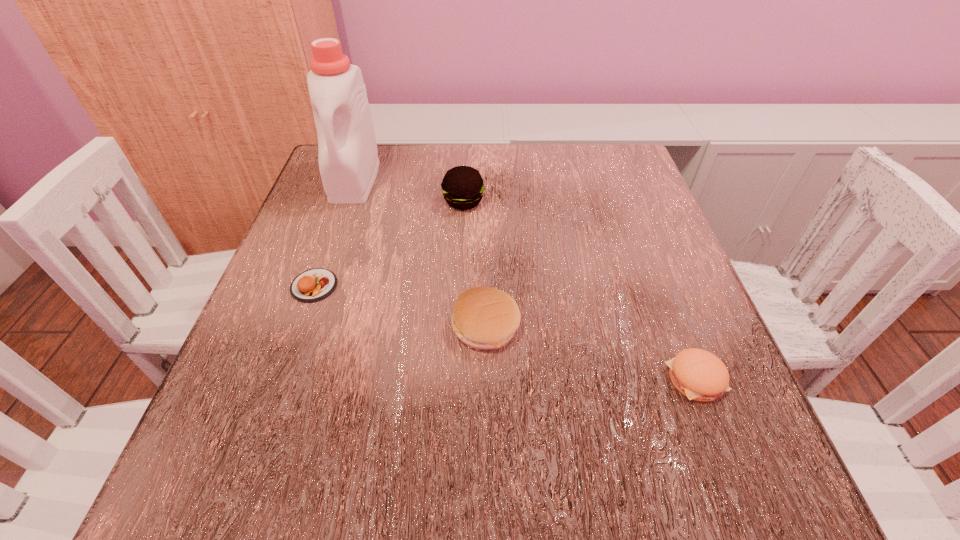
Where is `free space at the near edge of the desktop`? This screenshot has height=540, width=960. free space at the near edge of the desktop is located at coordinates (611, 498).

Find the location of `vacant space at the left edge`. vacant space at the left edge is located at coordinates (345, 298).

Where is `free space at the right edge of the desktop`? This screenshot has width=960, height=540. free space at the right edge of the desktop is located at coordinates (654, 243).

Find the location of a particular element. vacant space at the far right corner of the desktop is located at coordinates (646, 195).

Identify the location of vacant space at the near right corner of the desktop. (692, 503).

You are a GUI agent. You are given a task and a screenshot of the screen. Output one action in this format:
    pyautogui.click(x=<x>, y=<y>)
    Task: Click on the empty space that is in between the rightmost patty (food) and the third shortest object
    The image size is (960, 540).
    Given the screenshot: What is the action you would take?
    pyautogui.click(x=590, y=353)

Where is `unoccupied area between the tallest object and the third shortest patty (food)`? This screenshot has height=540, width=960. unoccupied area between the tallest object and the third shortest patty (food) is located at coordinates (420, 253).

Where is `vacant region between the farthest patty (food) and the detergent`? The height and width of the screenshot is (540, 960). vacant region between the farthest patty (food) and the detergent is located at coordinates (409, 191).

This screenshot has height=540, width=960. I want to click on free spot between the second tallest patty (food) and the shortest object, so click(x=400, y=306).

Identify the location of unoccupied position between the tallest patty (food) and the fourth tallest object. (579, 290).